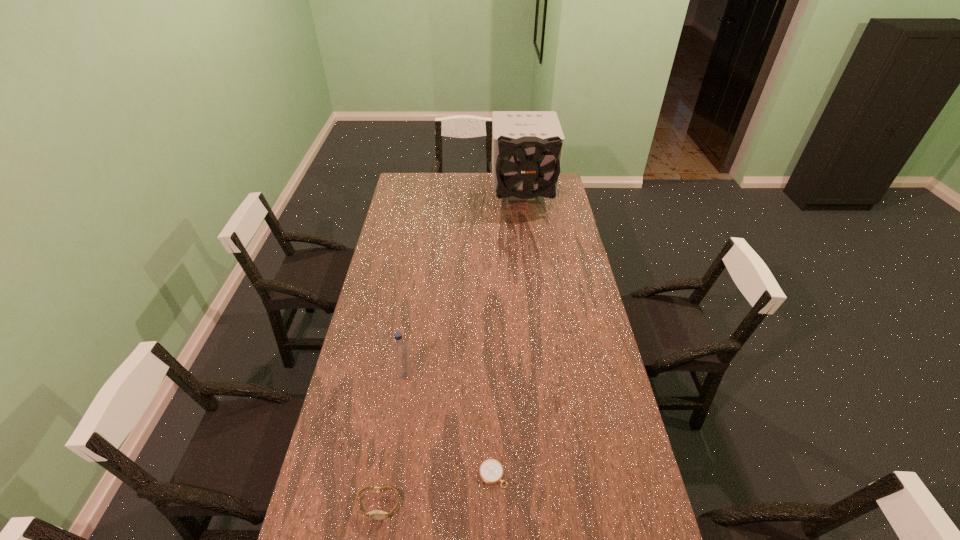
Find the location of a particular element. This screenshot has height=540, width=960. the tallest object is located at coordinates (527, 146).

What are the coordinates of `the farthest object` in the screenshot? It's located at coord(527,146).

This screenshot has height=540, width=960. What are the coordinates of `the third shortest object` in the screenshot? It's located at (400, 350).

In order to click on water bottle in this screenshot , I will do `click(400, 350)`.

Locate an element on the screen. This screenshot has width=960, height=540. the nearest object is located at coordinates (375, 514).

This screenshot has width=960, height=540. Identify the location of watch. (375, 514).

Identify the location of compass. (491, 471).

Where is `the shortest object`? The image size is (960, 540). the shortest object is located at coordinates (491, 471).

Find the location of a particular element. The width and height of the screenshot is (960, 540). free point located on the front of the fan is located at coordinates (529, 252).

Find the location of a particular element. free space located 0.150m on the left of the third nearest object is located at coordinates (354, 375).